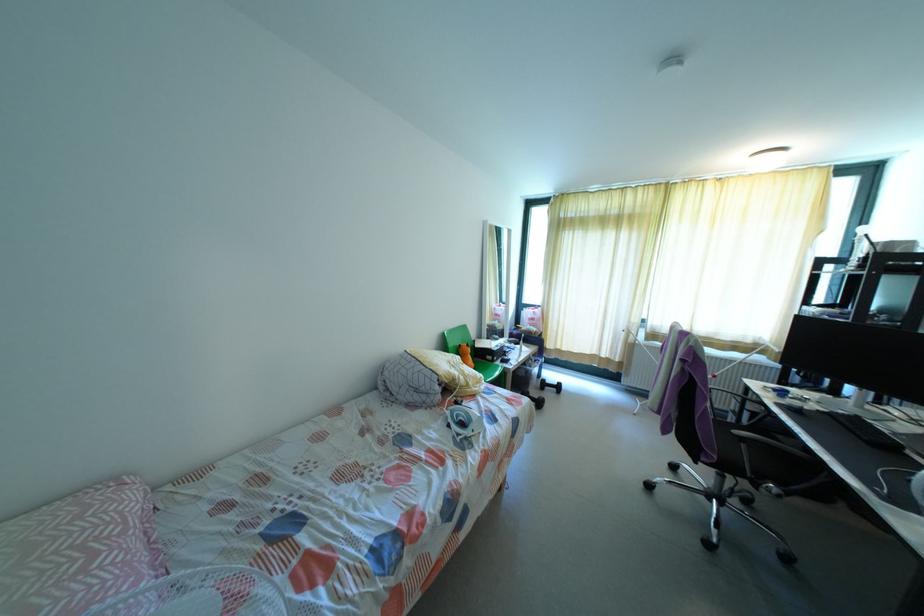
At what (x,y) coordinates should I click in order to perform the action: click on pink paper bag. Please return your answer as a coordinate pair (x, y). Looking at the image, I should click on (531, 318).